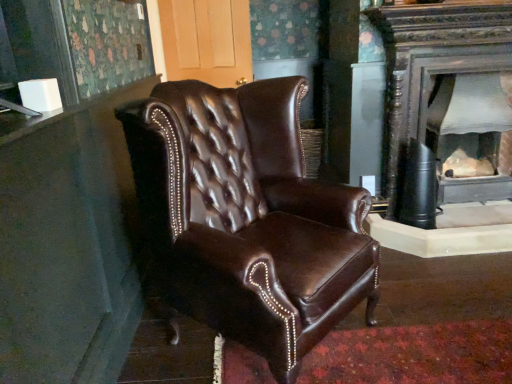
Describe the element at coordinates (471, 136) in the screenshot. I see `matte black fireplace at right` at that location.

The height and width of the screenshot is (384, 512). Find the location of `matte black fireplace at right`. matte black fireplace at right is located at coordinates 471,136.

Find the location of `brown leather chair at center`. brown leather chair at center is located at coordinates (247, 217).

What is the approximate width of brown leather chair at center?

→ The width of brown leather chair at center is 31.08 inches.

What do you see at coordinates (247, 217) in the screenshot?
I see `brown leather chair at center` at bounding box center [247, 217].

Where is `matte black fireplace at right`? The image size is (512, 384). matte black fireplace at right is located at coordinates (471, 136).

Can you confirm if brown leather chair at center is positioned to the left of matte black fireplace at right?

Correct, you'll find brown leather chair at center to the left of matte black fireplace at right.

Which is behind, brown leather chair at center or matte black fireplace at right?

matte black fireplace at right is behind.

Is point (216, 138) positioned after point (477, 80)?

That is False.

From the image's perspective, which one is positioned lower, brown leather chair at center or matte black fireplace at right?

brown leather chair at center is shown below in the image.

From a real-world perspective, is brown leather chair at center located higher than matte black fireplace at right?

Yes, from a real-world perspective, brown leather chair at center is over matte black fireplace at right

Considering the relative sizes of brown leather chair at center and matte black fireplace at right in the image provided, is brown leather chair at center thinner than matte black fireplace at right?

No, brown leather chair at center is not thinner than matte black fireplace at right.

Does brown leather chair at center have a lesser height compared to matte black fireplace at right?

In fact, brown leather chair at center may be taller than matte black fireplace at right.

Can you confirm if brown leather chair at center is bigger than matte black fireplace at right?

Yes.

Is brown leather chair at center outside of matte black fireplace at right?

Yes.

Is brown leather chair at center touching matte black fireplace at right?

No, brown leather chair at center is not making contact with matte black fireplace at right.

Is brown leather chair at center aimed at matte black fireplace at right?

No, brown leather chair at center is not oriented towards matte black fireplace at right.

Can you tell me how much brown leather chair at center and matte black fireplace at right differ in facing direction?

brown leather chair at center and matte black fireplace at right are facing 47.5 degrees away from each other.

Where is `chair positioned vertically above the matte black fireplace at right (from a real-world perspective)`? chair positioned vertically above the matte black fireplace at right (from a real-world perspective) is located at coordinates (247, 217).

Between matte black fireplace at right and brown leather chair at center, which one appears on the left side from the viewer's perspective?

brown leather chair at center is more to the left.

Which object is closer to the camera taking this photo, matte black fireplace at right or brown leather chair at center?

Positioned in front is brown leather chair at center.

Which is closer, (x=484, y=135) or (x=256, y=229)?

Point (x=484, y=135) is positioned farther from the camera compared to point (x=256, y=229).

From the image's perspective, is matte black fireplace at right located above or below brown leather chair at center?

From the image's perspective, matte black fireplace at right appears above brown leather chair at center.

From a real-world perspective, between matte black fireplace at right and brown leather chair at center, who is vertically lower?

matte black fireplace at right.

In the scene shown: Is matte black fireplace at right wider or thinner than brown leather chair at center?

In the image, matte black fireplace at right appears to be more narrow than brown leather chair at center.

Considering the sizes of matte black fireplace at right and brown leather chair at center in the image, is matte black fireplace at right taller or shorter than brown leather chair at center?

matte black fireplace at right is shorter than brown leather chair at center.

Considering the relative sizes of matte black fireplace at right and brown leather chair at center in the image provided, is matte black fireplace at right smaller than brown leather chair at center?

Yes, matte black fireplace at right is smaller than brown leather chair at center.

Is matte black fireplace at right positioned beyond the bounds of brown leather chair at center?

Indeed, matte black fireplace at right is completely outside brown leather chair at center.

Is matte black fireplace at right not close to brown leather chair at center?

Yes.

Is matte black fireplace at right oriented towards brown leather chair at center?

No, matte black fireplace at right is not facing towards brown leather chair at center.

Looking at this image, can you tell me how much matte black fireplace at right and brown leather chair at center differ in facing direction?

47.5 degrees separate the facing orientations of matte black fireplace at right and brown leather chair at center.

The image size is (512, 384). Identify the location of chair above the matte black fireplace at right (from a real-world perspective). (247, 217).

Where is `chair that is in front of the matte black fireplace at right`? This screenshot has width=512, height=384. chair that is in front of the matte black fireplace at right is located at coordinates (247, 217).

The width and height of the screenshot is (512, 384). Identify the location of chair on the left of matte black fireplace at right. (247, 217).